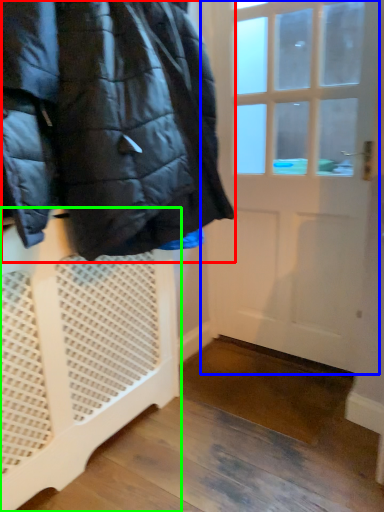
Question: Which is nearer to the jacket (highlighted by a red box)? door (highlighted by a blue box) or furniture (highlighted by a green box).

Choices:
 (A) door
 (B) furniture

Answer: (B)